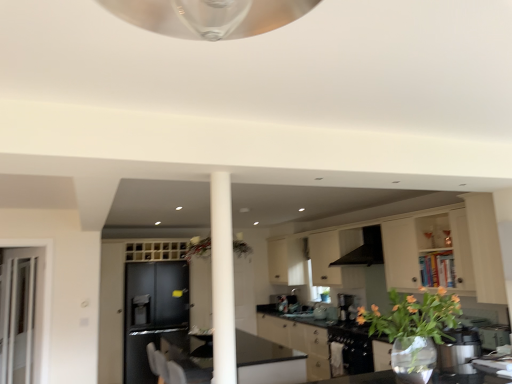
At what (x,y) coordinates should I click in order to perform the action: click on satin black coffee machine at center. Please return your answer as a coordinate pair (x, y). The width and height of the screenshot is (512, 384). Looking at the image, I should click on (345, 307).

What do you see at coordinates (365, 250) in the screenshot?
I see `black matte exhaust hood at center` at bounding box center [365, 250].

At what (x,y) coordinates should I click in order to perform the action: click on clear glass door at left. Please return your answer as a coordinate pair (x, y). The width and height of the screenshot is (512, 384). Looking at the image, I should click on (17, 319).

Locate an element on the screen. This screenshot has height=384, width=512. matte black cabinet at left, positioned as the third cabinetry in right-to-left order is located at coordinates (157, 295).

Where is `satin black coffee machine at center`? The height and width of the screenshot is (384, 512). satin black coffee machine at center is located at coordinates (345, 307).

Is clear glass door at left turned away from satin black coffee machine at center?

No.

From their relative heights in the image, would you say clear glass door at left is taller or shorter than satin black coffee machine at center?

In the image, clear glass door at left appears to be taller than satin black coffee machine at center.

Considering the points (2, 313) and (354, 316), which point is behind, point (2, 313) or point (354, 316)?

Positioned behind is point (354, 316).

From a real-world perspective, who is located higher, clear glass door at left or satin black coffee machine at center?

In real-world perspective, clear glass door at left is above.

From the image's perspective, does matte black cabinet at left, positioned as the third cabinetry in right-to-left order, appear higher than translucent glass vase at lower right?

No.

Identify the location of the 2nd cabinetry to the left of the translucent glass vase at lower right, starting your count from the anchor. (157, 295).

From a real-world perspective, which object stands above the other?

In real-world perspective, translucent glass vase at lower right is above.

Is matte black cabinet at left, positioned as the third cabinetry in right-to-left order, to the right of translucent glass vase at lower right from the viewer's perspective?

No.

From the picture: How different are the orientations of translucent glass vase at lower right and matte black cabinet at left, which ranks as the first cabinetry in left-to-right order, in degrees?

The angle between the facing direction of translucent glass vase at lower right and the facing direction of matte black cabinet at left, which ranks as the first cabinetry in left-to-right order, is 179 degrees.

Considering the points (413, 367) and (169, 281), which point is in front, point (413, 367) or point (169, 281)?

Point (413, 367)

Who is shorter, translucent glass vase at lower right or matte black cabinet at left, positioned as the third cabinetry in right-to-left order?

translucent glass vase at lower right is shorter.

Locate an element on the screen. The height and width of the screenshot is (384, 512). exhaust hood above the satin black coffee machine at center (from the image's perspective) is located at coordinates (365, 250).

Would you say satin black coffee machine at center is a long distance from black matte exhaust hood at center?

No, satin black coffee machine at center is not far away from black matte exhaust hood at center.

How much distance is there between satin black coffee machine at center and black matte exhaust hood at center?

satin black coffee machine at center is 25.84 inches away from black matte exhaust hood at center.

Who is bigger, satin black coffee machine at center or black matte exhaust hood at center?

Bigger between the two is black matte exhaust hood at center.

Considering the sizes of objects matte white cabinets at center, acting as the 1th cabinetry starting from the right, and black matte exhaust hood at center in the image provided, who is thinner, matte white cabinets at center, acting as the 1th cabinetry starting from the right, or black matte exhaust hood at center?

black matte exhaust hood at center.

From the image's perspective, count 1st cabinetrys downward from the black matte exhaust hood at center and point to it. Please provide its 2D coordinates.

[(418, 249)]

Is matte white cabinets at center, positioned as the 3th cabinetry in left-to-right order, to the left or to the right of black matte exhaust hood at center in the image?

In the image, matte white cabinets at center, positioned as the 3th cabinetry in left-to-right order, appears on the left side of black matte exhaust hood at center.

Are matte white cabinets at center, positioned as the 3th cabinetry in left-to-right order, and black matte exhaust hood at center far apart?

Absolutely, matte white cabinets at center, positioned as the 3th cabinetry in left-to-right order, is distant from black matte exhaust hood at center.

From the picture: From the image's perspective, would you say matte white cabinets at center, acting as the 1th cabinetry starting from the right, is shown under clear glass door at left?

A: No, from the image's perspective, matte white cabinets at center, acting as the 1th cabinetry starting from the right, is not below clear glass door at left.

Which is less distant, (490, 236) or (26, 380)?

Clearly, point (490, 236) is closer to the camera than point (26, 380).

Is matte white cabinets at center, acting as the 1th cabinetry starting from the right, facing towards clear glass door at left?

Yes, matte white cabinets at center, acting as the 1th cabinetry starting from the right, is turned towards clear glass door at left.

Between black matte exhaust hood at center and black glossy countertop at center, which one appears on the right side from the viewer's perspective?

black matte exhaust hood at center is more to the right.

In terms of width, does black matte exhaust hood at center look wider or thinner when compared to black glossy countertop at center?

Considering their sizes, black matte exhaust hood at center looks slimmer than black glossy countertop at center.

From the image's perspective, relative to black glossy countertop at center, is black matte exhaust hood at center above or below?

From the image's perspective, black matte exhaust hood at center appears above black glossy countertop at center.

Where is `coffee machine that is on the right side of clear glass door at left`? Image resolution: width=512 pixels, height=384 pixels. coffee machine that is on the right side of clear glass door at left is located at coordinates (345, 307).

This screenshot has width=512, height=384. I want to click on cabinetry that is the 3rd one when counting backward from the translucent glass vase at lower right, so tap(157, 295).

Estimate the real-world distances between objects in this image. Which object is further from matte beige cabinets at center, which is counted as the second cabinetry, starting from the right, satin black coffee machine at center or black matte exhaust hood at center?

black matte exhaust hood at center.

Estimate the real-world distances between objects in this image. Which object is closer to clear glass door at left, matte black cabinet at left, positioned as the third cabinetry in right-to-left order, or satin black coffee machine at center?

matte black cabinet at left, positioned as the third cabinetry in right-to-left order.

From the image, which object appears to be farther from clear glass door at left, matte beige cabinets at center, which is counted as the second cabinetry, starting from the right, or translucent glass vase at lower right?

translucent glass vase at lower right.

Which object lies nearer to the anchor point matte white cabinets at center, acting as the 1th cabinetry starting from the right, clear glass door at left or transparent glass table at lower right?

The object closer to matte white cabinets at center, acting as the 1th cabinetry starting from the right, is transparent glass table at lower right.

Considering their positions, is matte beige cabinets at center, which is counted as the second cabinetry, starting from the right, positioned further to clear glass door at left than matte black cabinet at left, which ranks as the first cabinetry in left-to-right order?

matte beige cabinets at center, which is counted as the second cabinetry, starting from the right.

Estimate the real-world distances between objects in this image. Which object is further from black matte exhaust hood at center, black glossy countertop at center or clear glass door at left?

Among the two, clear glass door at left is located further to black matte exhaust hood at center.

Estimate the real-world distances between objects in this image. Which object is further from satin black coffee machine at center, black matte exhaust hood at center or matte white cabinets at center, positioned as the 3th cabinetry in left-to-right order?

matte white cabinets at center, positioned as the 3th cabinetry in left-to-right order.

Estimate the real-world distances between objects in this image. Which object is further from matte black cabinet at left, which ranks as the first cabinetry in left-to-right order, clear glass door at left or translucent glass vase at lower right?

translucent glass vase at lower right.

Identify the location of cabinetry that lies between translucent glass vase at lower right and black glossy countertop at center from top to bottom. (418, 249).

Locate an element on the screen. coffee machine between matte black cabinet at left, which ranks as the first cabinetry in left-to-right order, and black matte exhaust hood at center, in the horizontal direction is located at coordinates (345, 307).

Image resolution: width=512 pixels, height=384 pixels. I want to click on countertop located between translucent glass vase at lower right and matte beige cabinets at center, which is counted as the second cabinetry, starting from the right, in the depth direction, so click(x=278, y=327).

The height and width of the screenshot is (384, 512). Find the location of `houseplant between transparent glass table at lower right and matte beige cabinets at center, marked as the 2th cabinetry in a left-to-right arrangement, in the front-back direction`. houseplant between transparent glass table at lower right and matte beige cabinets at center, marked as the 2th cabinetry in a left-to-right arrangement, in the front-back direction is located at coordinates [x=414, y=330].